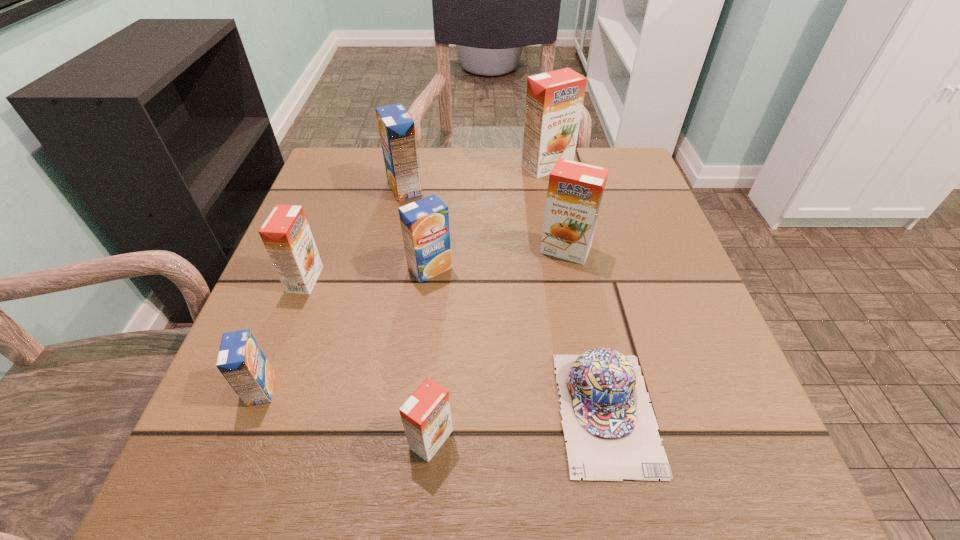
You are a GUI agent. You are given a task and a screenshot of the screen. Output one action in this format:
    pyautogui.click(x=<x>, y=<y>)
    Task: Click on the cap situated at the near edge
    The width and height of the screenshot is (960, 540).
    Given the screenshot: What is the action you would take?
    611,431

Identify the location of cap that is at the right edge. This screenshot has height=540, width=960. (611, 431).

Find the location of a particular element. The height and width of the screenshot is (540, 960). object present at the far right corner is located at coordinates (554, 100).

Locate an element on the screen. This screenshot has height=540, width=960. object present at the near right corner is located at coordinates (611, 431).

The height and width of the screenshot is (540, 960). In the image, there is a desktop. In order to click on free region at the far edge in this screenshot , I will do `click(468, 201)`.

I want to click on vacant space at the near edge of the desktop, so click(331, 474).

Where is `vacant space at the left edge of the desktop`? The image size is (960, 540). vacant space at the left edge of the desktop is located at coordinates (310, 360).

Where is `vacant space at the right edge`? Image resolution: width=960 pixels, height=540 pixels. vacant space at the right edge is located at coordinates (598, 276).

The width and height of the screenshot is (960, 540). Identify the location of blank space at the far left corner of the desktop. (320, 197).

Identify the location of vacant area at the far right corner. The image size is (960, 540). (626, 172).